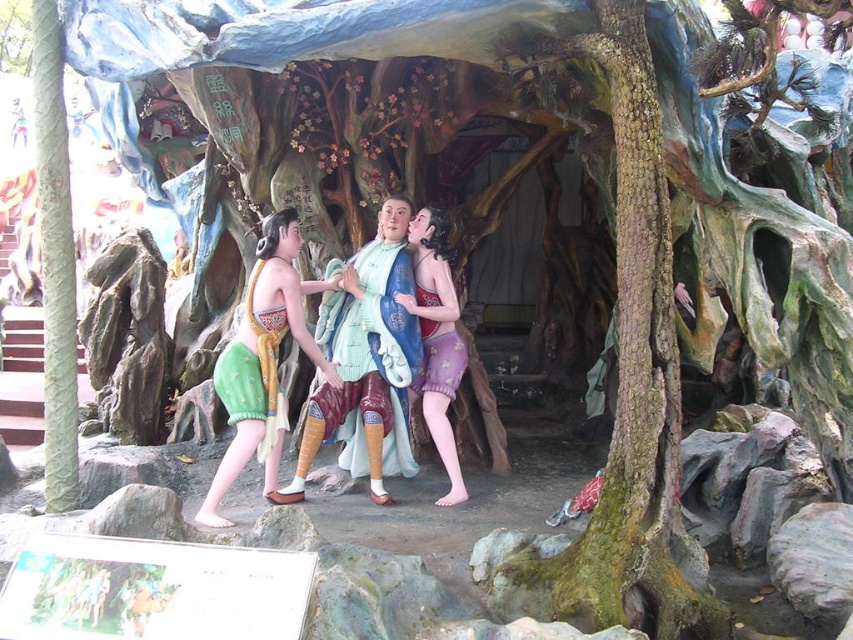
Who is positioned more to the left, green fabric skirt at center or matte purple fabric skirt at center?

Positioned to the left is green fabric skirt at center.

Find the location of a particular element. This screenshot has height=640, width=853. green fabric skirt at center is located at coordinates (262, 360).

Can you confirm if matte green fabric dress at center is positioned above green fabric skirt at center?

Indeed, matte green fabric dress at center is positioned over green fabric skirt at center.

Is matte green fabric dress at center to the right of green fabric skirt at center from the viewer's perspective?

Indeed, matte green fabric dress at center is positioned on the right side of green fabric skirt at center.

Find the location of a particular element. Image resolution: width=853 pixels, height=640 pixels. matte green fabric dress at center is located at coordinates (364, 362).

Where is `matte green fabric dress at center`? The image size is (853, 640). matte green fabric dress at center is located at coordinates (364, 362).

Who is more forward, (387,198) or (442,440)?

Point (442,440)

Find the location of `matte green fabric dress at center`. matte green fabric dress at center is located at coordinates (364, 362).